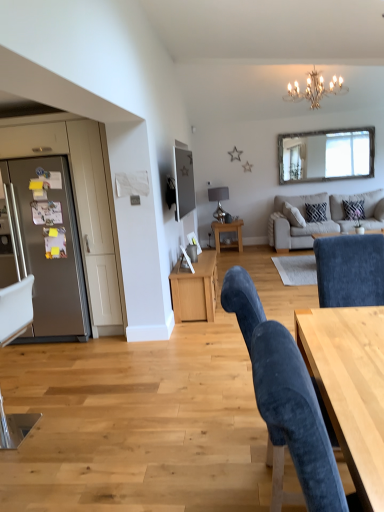
Question: Is matte black tv at upper center smaller than satin silver refrigerator at left?

Choices:
 (A) no
 (B) yes

Answer: (B)

Question: Is matte black tv at upper center oriented away from satin silver refrigerator at left?

Choices:
 (A) yes
 (B) no

Answer: (A)

Question: From the image's perspective, is matte black tv at upper center beneath satin silver refrigerator at left?

Choices:
 (A) yes
 (B) no

Answer: (B)

Question: Can you confirm if matte black tv at upper center is bigger than satin silver refrigerator at left?

Choices:
 (A) yes
 (B) no

Answer: (B)

Question: From a real-world perspective, is matte black tv at upper center located higher than satin silver refrigerator at left?

Choices:
 (A) yes
 (B) no

Answer: (A)

Question: Considering the relative positions of matte black tv at upper center and satin silver refrigerator at left in the image provided, is matte black tv at upper center to the left of satin silver refrigerator at left from the viewer's perspective?

Choices:
 (A) yes
 (B) no

Answer: (B)

Question: Would you say velvet blue chair at lower right, which is the second chair from left to right, is part of wooden side table at center's contents?

Choices:
 (A) yes
 (B) no

Answer: (B)

Question: From the image's perspective, does wooden side table at center appear lower than velvet blue chair at lower right, which is the 1th chair in front-to-back order?

Choices:
 (A) yes
 (B) no

Answer: (B)

Question: Is wooden side table at center looking in the opposite direction of velvet blue chair at lower right, which is the second chair from back to front?

Choices:
 (A) yes
 (B) no

Answer: (B)

Question: From a real-world perspective, is wooden side table at center below velvet blue chair at lower right, which is the second chair from back to front?

Choices:
 (A) no
 (B) yes

Answer: (B)

Question: Is wooden side table at center thinner than velvet blue chair at lower right, which is the second chair from left to right?

Choices:
 (A) yes
 (B) no

Answer: (A)

Question: Is wooden side table at center located outside velvet blue chair at lower right, which is the second chair from back to front?

Choices:
 (A) yes
 (B) no

Answer: (A)

Question: Is beige fabric couch at upper right taller than metallic silver chair at left, the first chair when ordered from left to right?

Choices:
 (A) yes
 (B) no

Answer: (B)